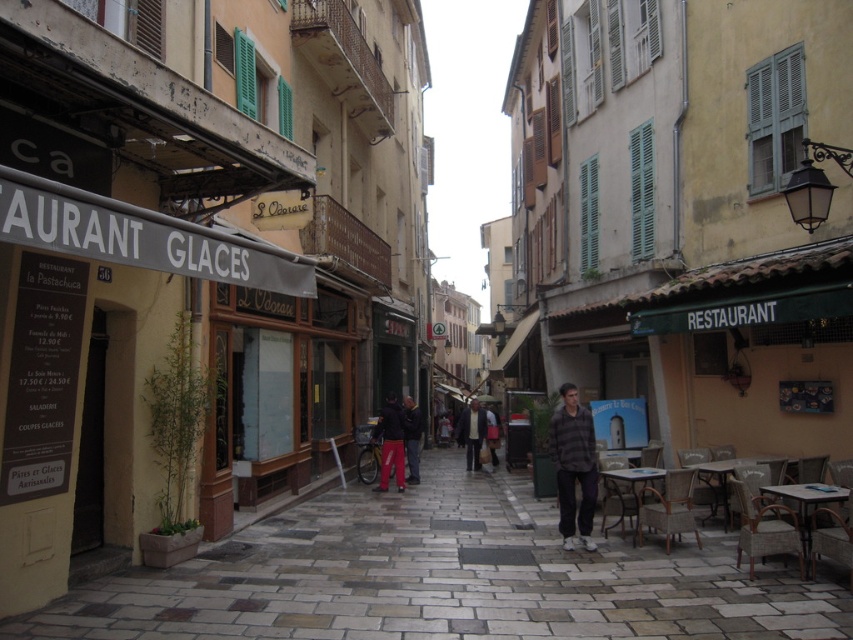
What do you see at coordinates (445, 579) in the screenshot? This screenshot has height=640, width=853. I see `stone paving at center` at bounding box center [445, 579].

Measure the distance between stone paving at center and plaid shirt at center.

The distance of stone paving at center from plaid shirt at center is 2.24 meters.

This screenshot has height=640, width=853. What do you see at coordinates (445, 579) in the screenshot?
I see `stone paving at center` at bounding box center [445, 579].

This screenshot has width=853, height=640. I want to click on stone paving at center, so click(445, 579).

Which is behind, point (457, 440) or point (415, 433)?

The point (457, 440) is more distant.

Does point (469, 435) come behind point (416, 419)?

Yes, it is.

Find the location of a particular element. The width and height of the screenshot is (853, 640). dark gray sweater at center is located at coordinates (473, 433).

Which is above, stone paving at center or dark gray sweater at center?

Positioned higher is stone paving at center.

Can you confirm if stone paving at center is bigger than dark gray sweater at center?

Yes.

At what (x,y) coordinates should I click in order to perform the action: click on stone paving at center. Please return your answer as a coordinate pair (x, y). The width and height of the screenshot is (853, 640). Looking at the image, I should click on (445, 579).